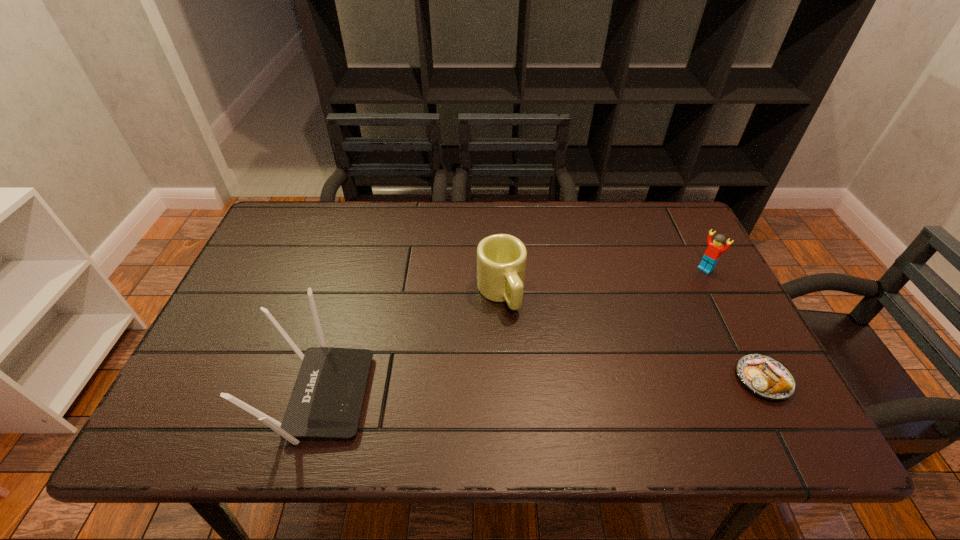
I want to click on free spot located 0.240m with the handle on the side of the mug, so click(x=550, y=395).

I want to click on vacant region located 0.160m with the handle on the side of the mug, so click(x=535, y=366).

Where is `vacant space positioned 0.170m with the handle on the side of the mug`? This screenshot has height=540, width=960. vacant space positioned 0.170m with the handle on the side of the mug is located at coordinates (537, 369).

Find the location of a particular element. This screenshot has width=960, height=540. router present at the near edge is located at coordinates (326, 402).

Identify the location of pastry that is at the near edge. This screenshot has width=960, height=540. (765, 376).

Locate an element on the screen. The height and width of the screenshot is (540, 960). pastry that is at the right edge is located at coordinates (765, 376).

Find the location of `Lego at the right edge`. Lego at the right edge is located at coordinates (715, 248).

At what (x,y) coordinates should I click in order to perform the action: click on object present at the near right corner. Please return your answer as a coordinate pair (x, y). Looking at the image, I should click on (765, 376).

In the image, there is a desktop. Identify the location of free space at the far edge. The width and height of the screenshot is (960, 540). (429, 247).

Where is `free space at the left edge of the desktop`? The image size is (960, 540). free space at the left edge of the desktop is located at coordinates (224, 336).